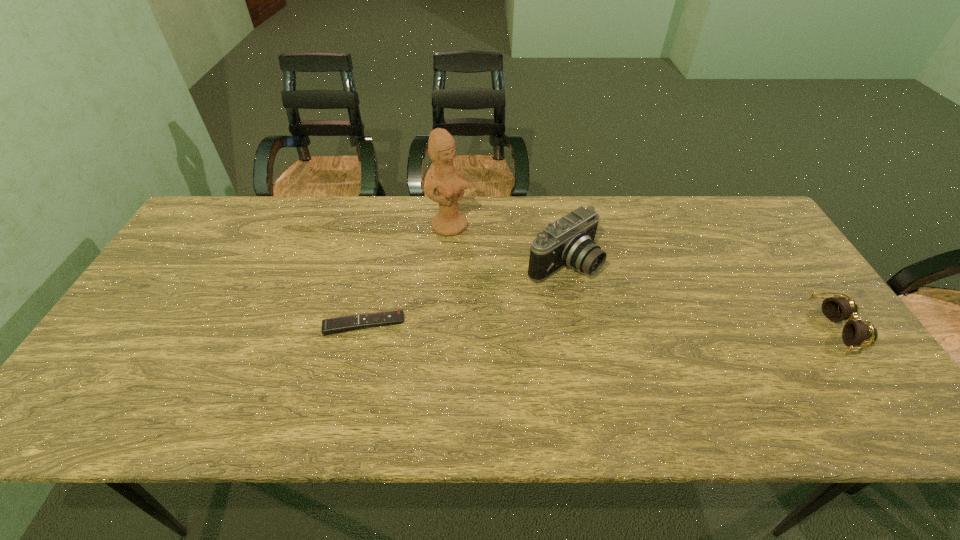
At what (x,y) coordinates should I click in order to perform the action: click on the leftmost object. Please return your answer as a coordinate pair (x, y). Image resolution: width=960 pixels, height=540 pixels. Looking at the image, I should click on [x=330, y=326].

Where is `the shortest object`? The height and width of the screenshot is (540, 960). the shortest object is located at coordinates (330, 326).

Where is `goggles`? This screenshot has height=540, width=960. goggles is located at coordinates (836, 309).

The height and width of the screenshot is (540, 960). What are the coordinates of `the rightmost object` in the screenshot? It's located at (836, 309).

You are a GUI agent. You are given a task and a screenshot of the screen. Output one action in this format:
    pyautogui.click(x=<x>, y=<y>)
    Task: Click on the tallest object
    This screenshot has width=960, height=540.
    Given the screenshot: What is the action you would take?
    pyautogui.click(x=449, y=182)

The width and height of the screenshot is (960, 540). I want to click on the second object from left to right, so (449, 182).

The width and height of the screenshot is (960, 540). Identify the location of the third object from left to right. (569, 241).

Identify the location of the second tallest object. (569, 241).

Where is `vacant space located 0.390m on the right of the leftmost object`? This screenshot has width=960, height=540. vacant space located 0.390m on the right of the leftmost object is located at coordinates (557, 324).

Locate an element on the screen. The image size is (960, 540). blank area located on the front-facing side of the farthest object is located at coordinates (522, 283).